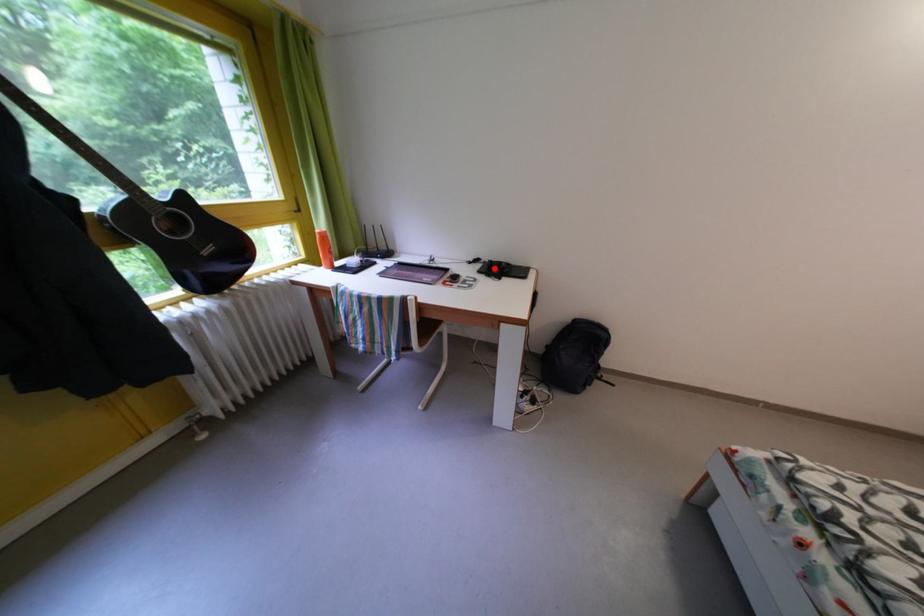
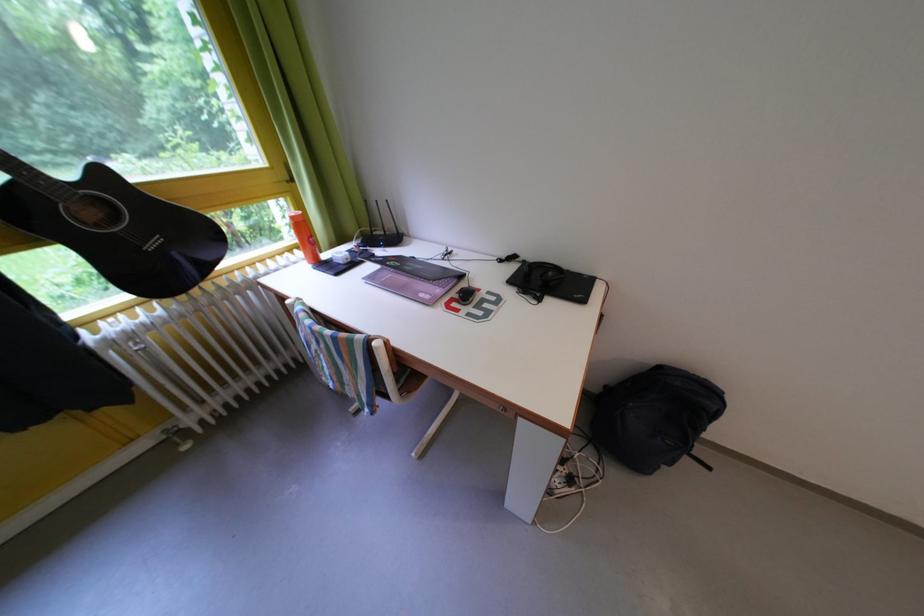
The point at the highlighted location is marked in the first image. Where is the corresponding point in the second image?

(533, 267)